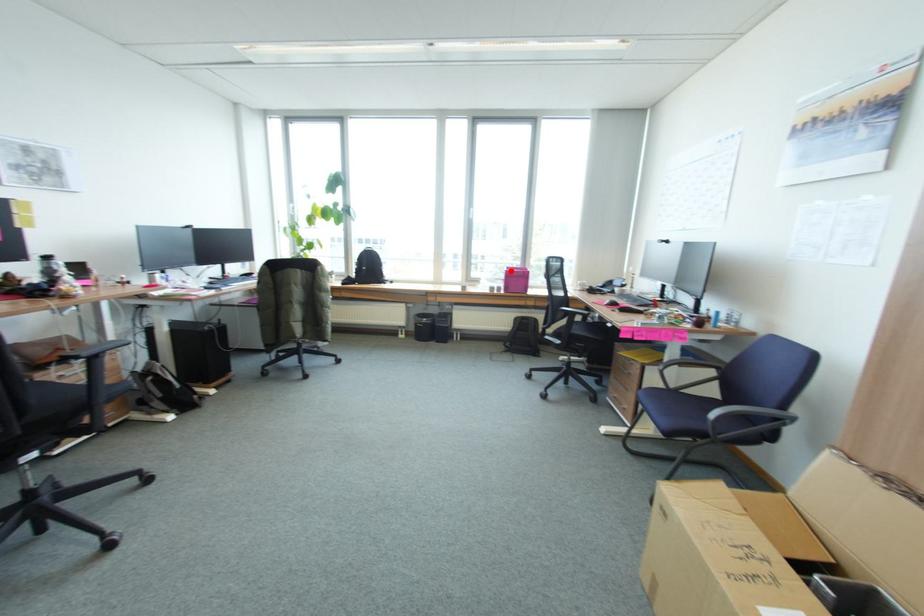
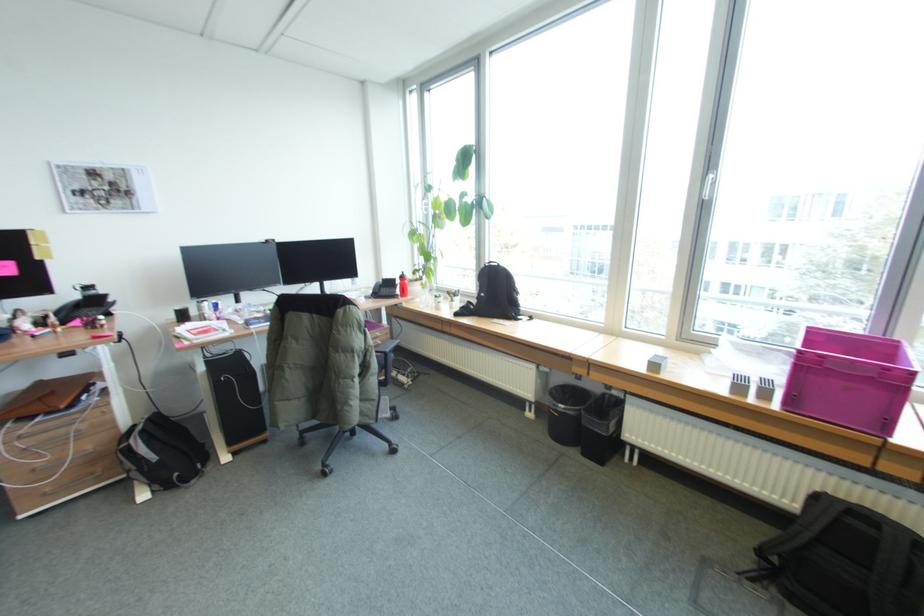
Question: I am providing you with two images of the same scene from different viewpoints. Image1 has a red point marked. In image2, the corresponding 3D location appears at what relative position? Reply with the corresponding letter.

Choices:
 (A) Closer
 (B) Farther

Answer: (B)